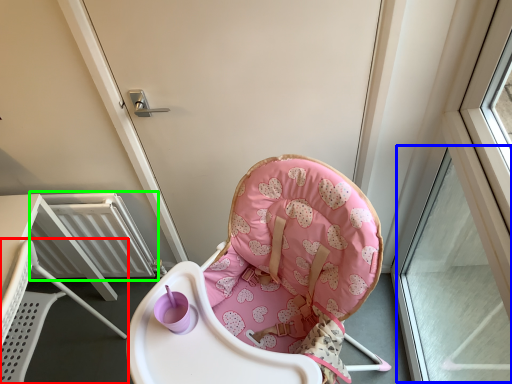
Question: Considering the real-world distances, which object is closest to chair (highlighted by a red box)? window (highlighted by a blue box) or radiator (highlighted by a green box).

Choices:
 (A) window
 (B) radiator

Answer: (B)